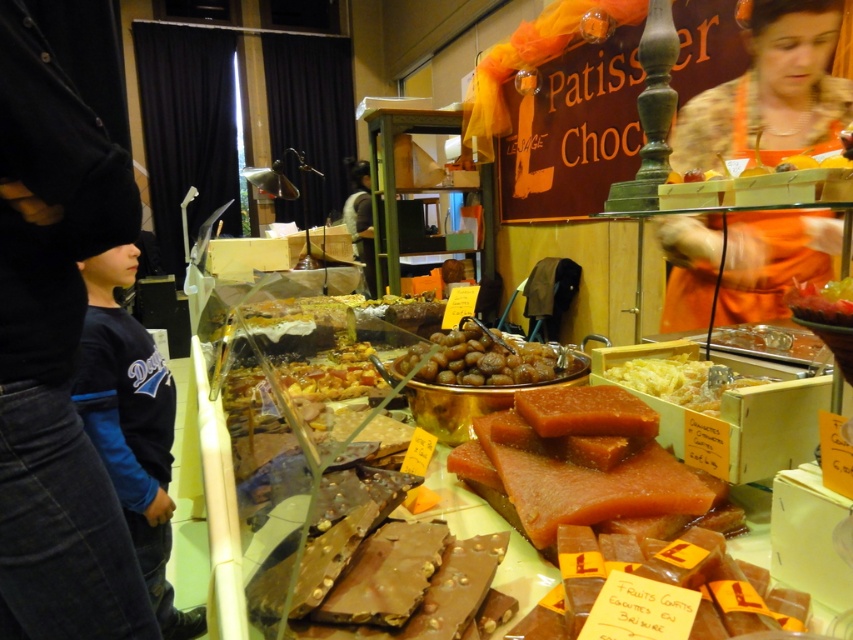
Question: Can you confirm if pink translucent jelly at center is positioned to the left of translucent yellow candy at center?

Choices:
 (A) no
 (B) yes

Answer: (B)

Question: Which is farther from the black fleece jacket at left?

Choices:
 (A) glistening caramelized nuts at center
 (B) white shirt at center

Answer: (B)

Question: Can you confirm if black fleece jacket at left is positioned below white shirt at center?

Choices:
 (A) yes
 (B) no

Answer: (A)

Question: Does black fleece jacket at left have a larger size compared to white shirt at center?

Choices:
 (A) yes
 (B) no

Answer: (B)

Question: Which of the following is the closest to the observer?

Choices:
 (A) pos(364,241)
 (B) pos(418,344)

Answer: (B)

Question: Which point appears farthest from the camera in this image?

Choices:
 (A) (820, 243)
 (B) (850, 280)
 (C) (659, 381)
 (D) (438, 340)

Answer: (A)